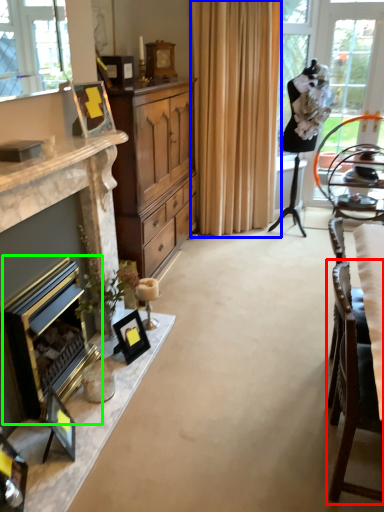
Question: Based on their relative distances, which object is farther from chair (highlighted by a red box)? Choose from curtain (highlighted by a blue box) and fireplace (highlighted by a green box).

Choices:
 (A) curtain
 (B) fireplace

Answer: (A)